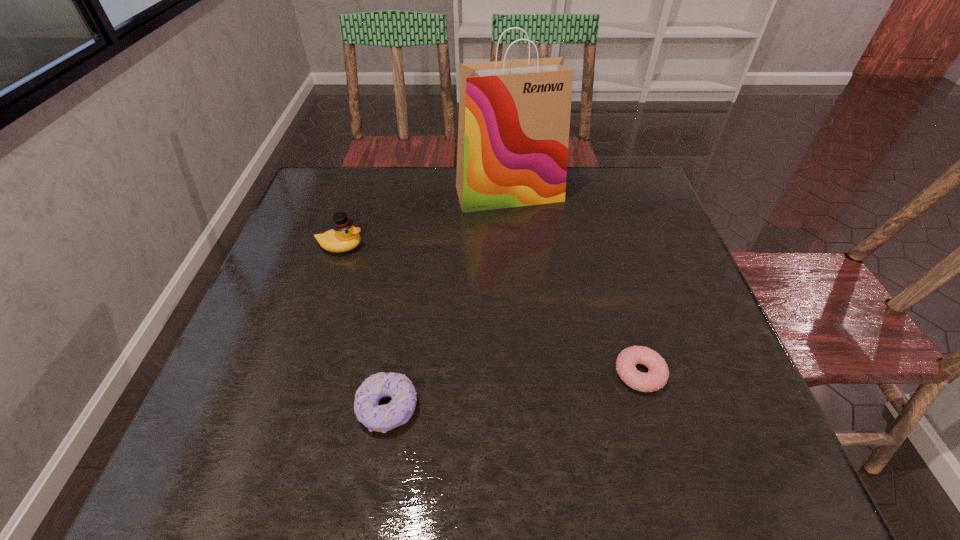
Locate an element on the screen. free space between the taller doughnut and the shopping bag is located at coordinates [x=448, y=301].

The image size is (960, 540). In order to click on free space between the rightmost object and the tallest object in this screenshot , I will do `click(574, 284)`.

Where is `the third closest object to the left doughnut`? The height and width of the screenshot is (540, 960). the third closest object to the left doughnut is located at coordinates (514, 116).

Where is `object that is the closest to the left doughnut`? The width and height of the screenshot is (960, 540). object that is the closest to the left doughnut is located at coordinates (343, 236).

The height and width of the screenshot is (540, 960). Identify the location of vacant space that satisfies the following two spatial constraints: 1. on the back side of the right doughnut; 2. on the front-facing side of the third nearest object. (603, 246).

Locate an element on the screen. The image size is (960, 540). vacant space that satisfies the following two spatial constraints: 1. on the front-facing side of the third nearest object; 2. on the back side of the third object from right to left is located at coordinates (288, 409).

The image size is (960, 540). I want to click on free space that satisfies the following two spatial constraints: 1. on the back side of the third tallest object; 2. on the front-facing side of the duck, so click(x=413, y=246).

Image resolution: width=960 pixels, height=540 pixels. In order to click on free space that satisfies the following two spatial constraints: 1. on the front-facing side of the rightmost object; 2. on the left side of the leftmost object in this screenshot , I will do point(300,374).

The height and width of the screenshot is (540, 960). In order to click on vacant region that satisfies the following two spatial constraints: 1. on the front-facing side of the duck; 2. on the back side of the rightmost object in this screenshot , I will do `click(300, 374)`.

At what (x,y) coordinates should I click in order to perform the action: click on vacant position in the image that satisfies the following two spatial constraints: 1. on the back side of the third tallest object; 2. on the front-facing side of the duck. Please return your answer as a coordinate pair (x, y). The width and height of the screenshot is (960, 540). Looking at the image, I should click on (413, 246).